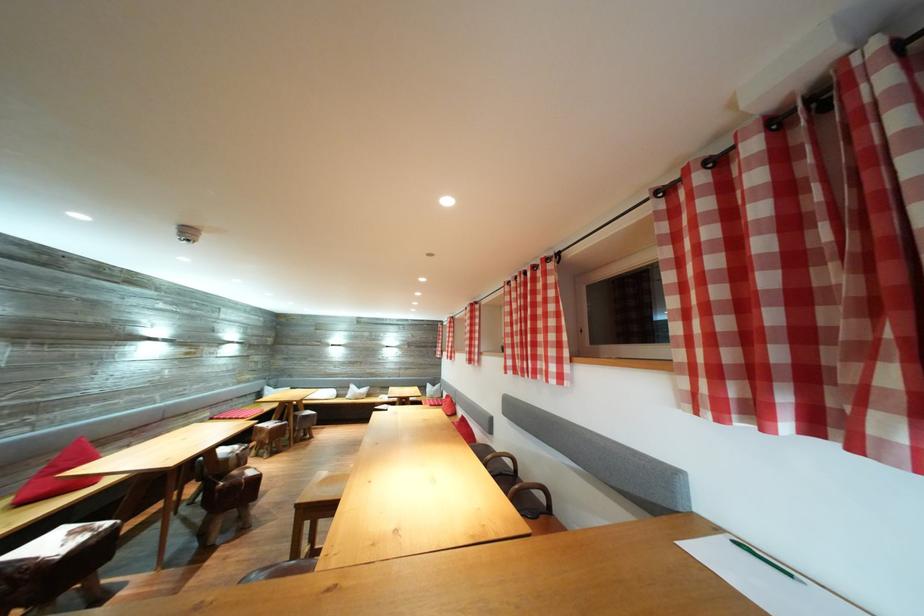
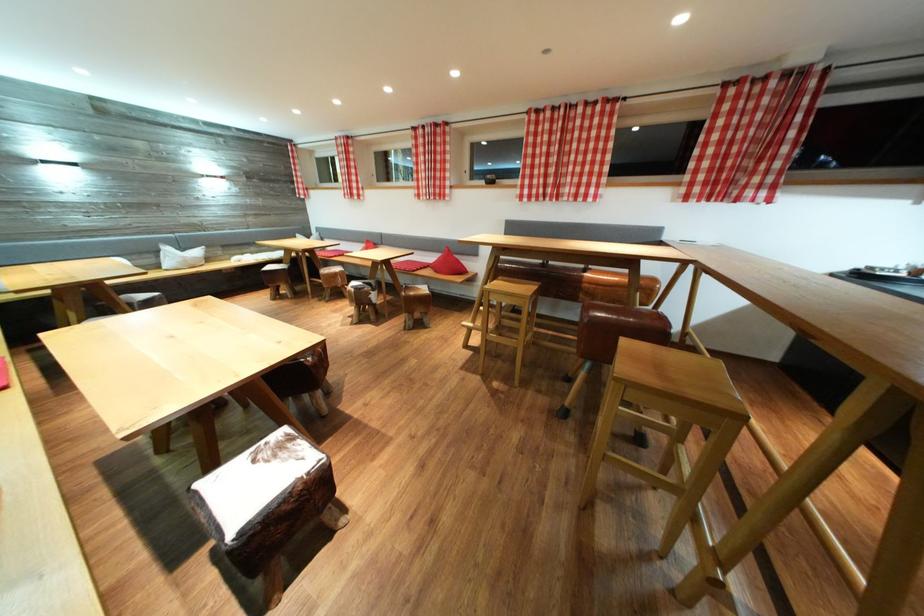
Locate, in the second image, the point that corresponds to (91,536) in the first image.

(286, 452)